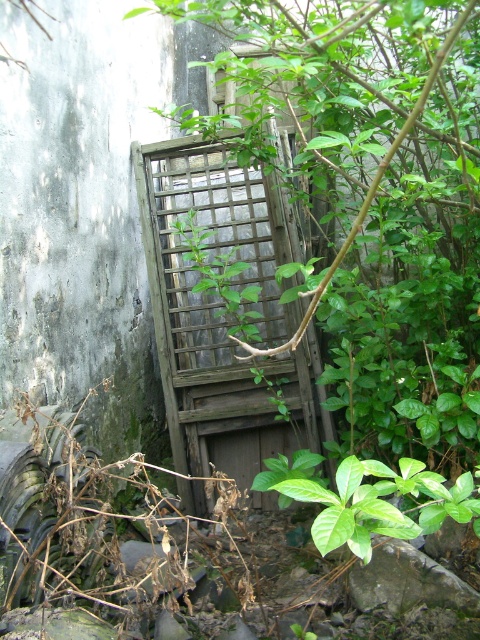
You are standing in front of the weathered wooden door and notice the weathered wood trellis at center and the green leafy plant at center. Which object is closer to your left side?

The weathered wood trellis at center is positioned on the left side of green leafy plant at center, so it is closer to your left side.